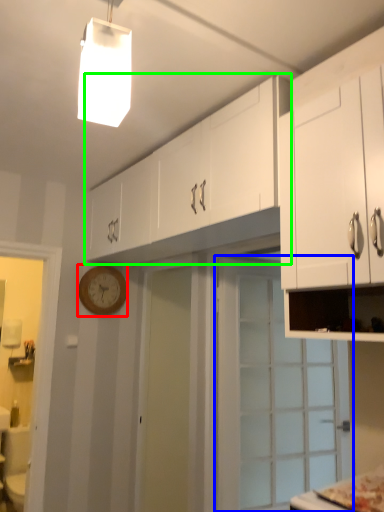
Question: Estimate the real-world distances between objects in this image. Which object is farther from clock (highlighted by a red box), door (highlighted by a blue box) or cabinetry (highlighted by a green box)?

Choices:
 (A) door
 (B) cabinetry

Answer: (A)